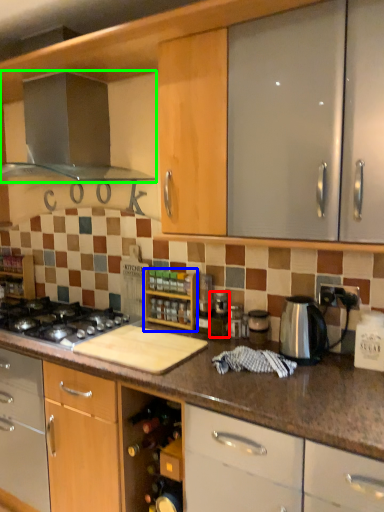
Question: Estimate the real-world distances between objects in this image. Which object is closer to appliance (highlighted by a red box), shelf (highlighted by a blue box) or kitchen appliance (highlighted by a green box)?

Choices:
 (A) shelf
 (B) kitchen appliance

Answer: (A)